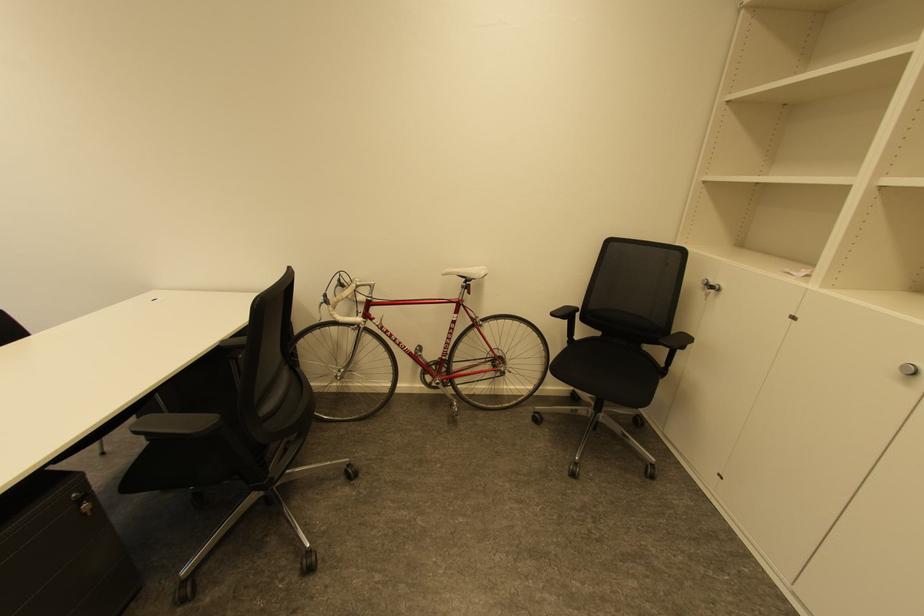
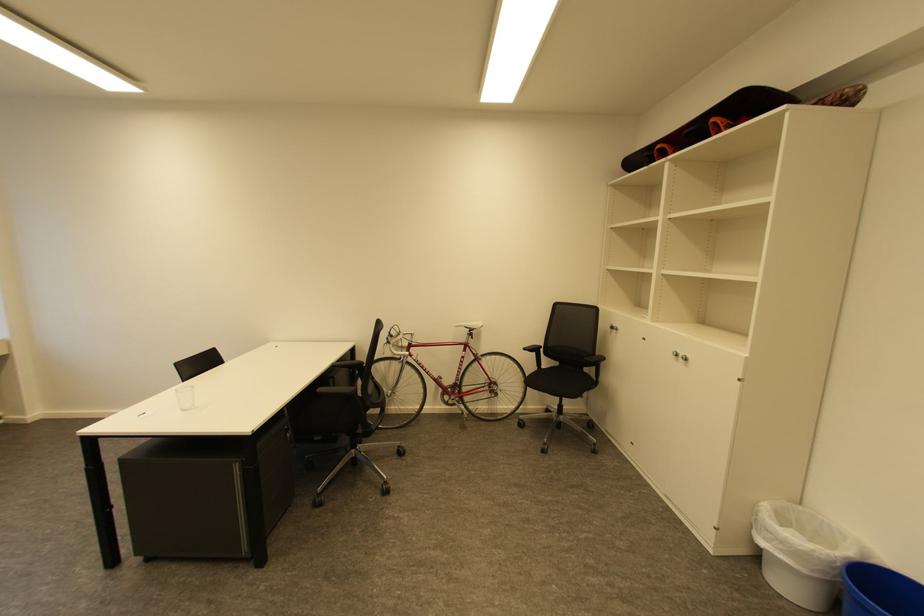
Locate, in the second image, the point that corresponds to (x=584, y=338) in the first image.

(551, 368)